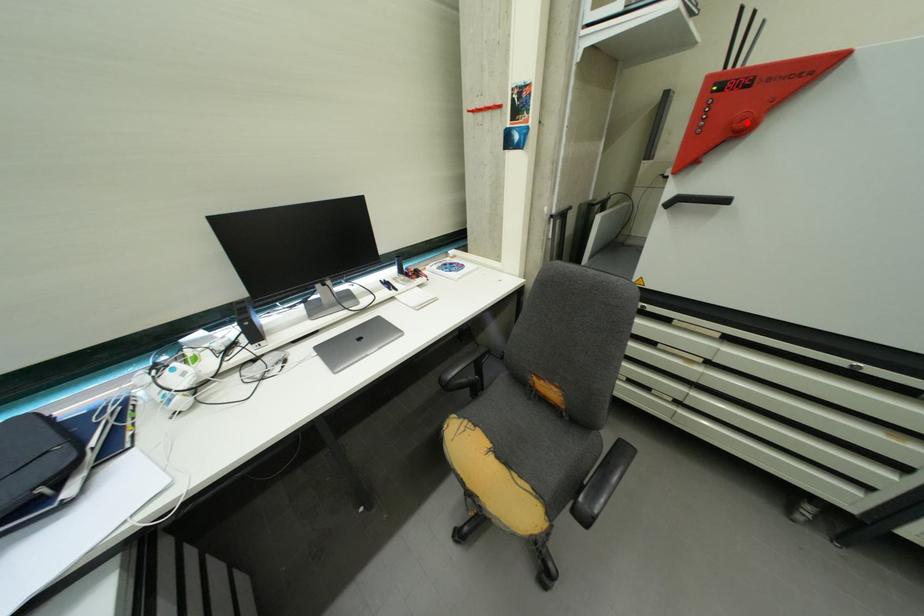
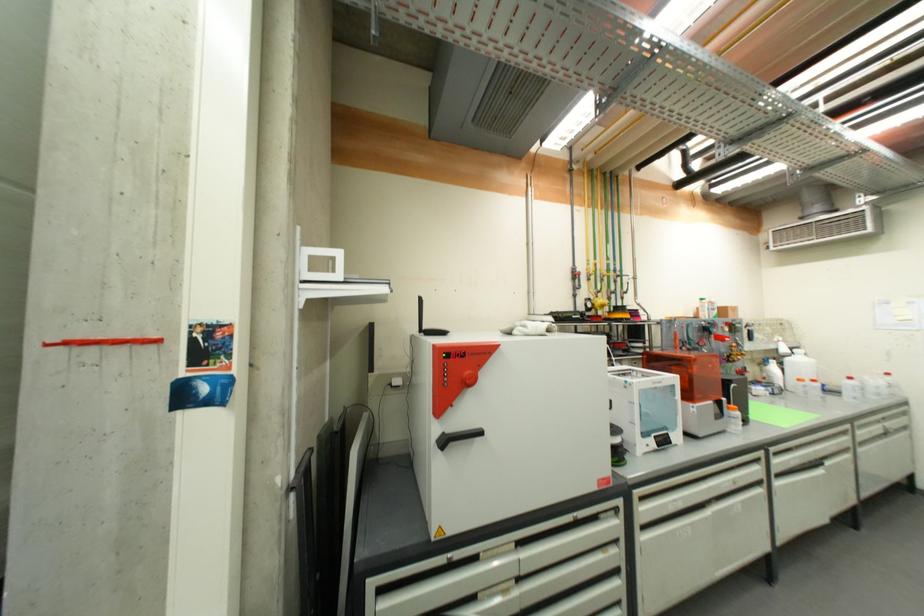
The point at the highlighted location is marked in the first image. Where is the corresponding point in the second image?

(476, 381)